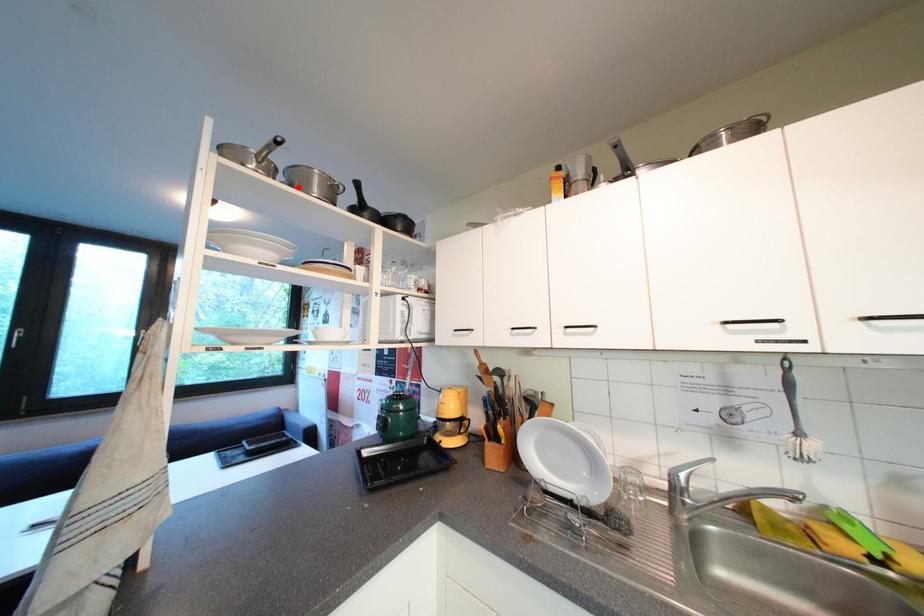
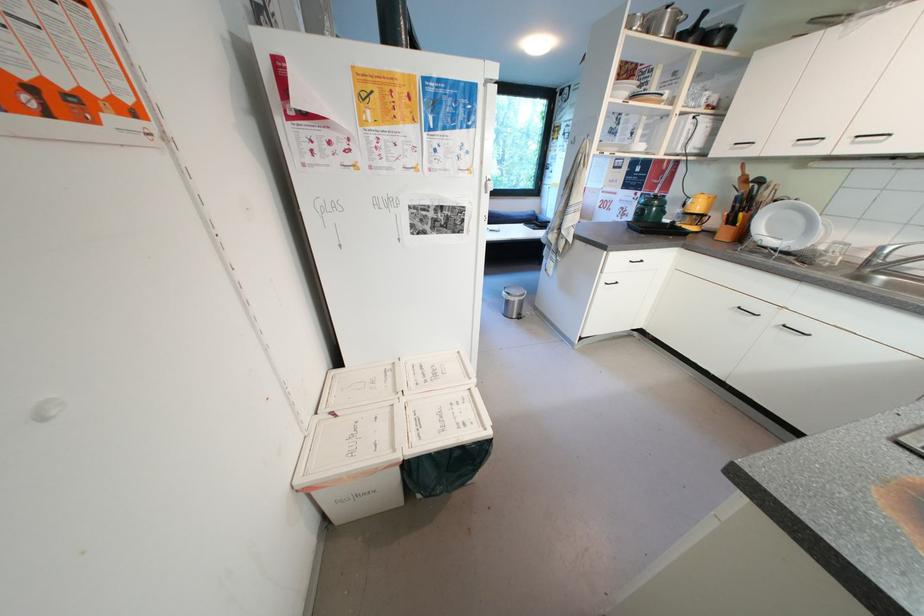
Question: I am providing you with two images of the same scene from different viewpoints. A red point is marked on the first image. Is the red point's position out of view in image 2?

Choices:
 (A) Yes
 (B) No

Answer: (B)